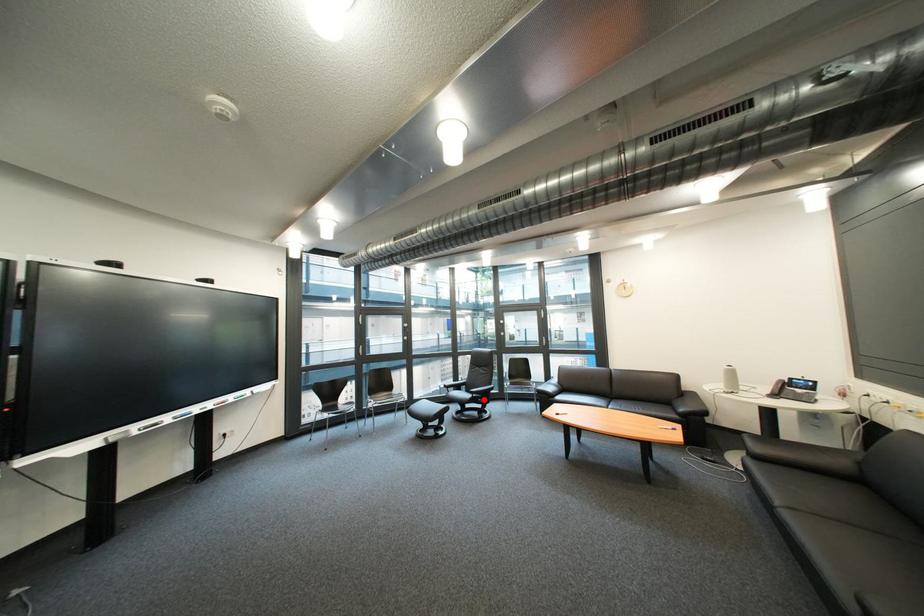
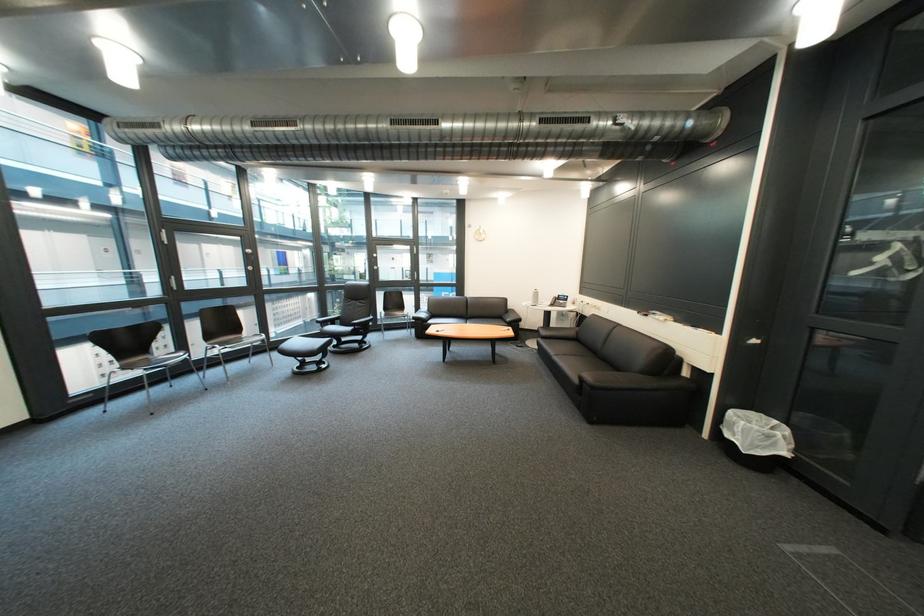
Where in the second image is the point corresponding to the highlighted location from the first image?

(366, 331)